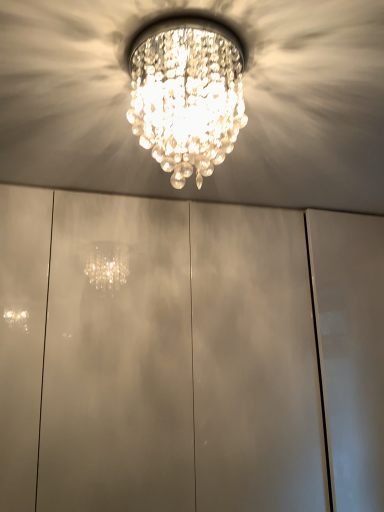
Question: Is clear crystal chandelier at center in front of or behind glossy white cabinet at center in the image?

Choices:
 (A) behind
 (B) front

Answer: (B)

Question: Is clear crystal chandelier at center inside the boundaries of glossy white cabinet at center, or outside?

Choices:
 (A) outside
 (B) inside

Answer: (A)

Question: From their relative heights in the image, would you say clear crystal chandelier at center is taller or shorter than glossy white cabinet at center?

Choices:
 (A) short
 (B) tall

Answer: (A)

Question: Considering their positions, is glossy white cabinet at center located in front of or behind clear crystal chandelier at center?

Choices:
 (A) behind
 (B) front

Answer: (A)

Question: In the image, is glossy white cabinet at center on the left side or the right side of clear crystal chandelier at center?

Choices:
 (A) left
 (B) right

Answer: (B)

Question: From the image's perspective, is glossy white cabinet at center located above or below clear crystal chandelier at center?

Choices:
 (A) below
 (B) above

Answer: (A)

Question: Looking at their shapes, would you say glossy white cabinet at center is wider or thinner than clear crystal chandelier at center?

Choices:
 (A) thin
 (B) wide

Answer: (B)